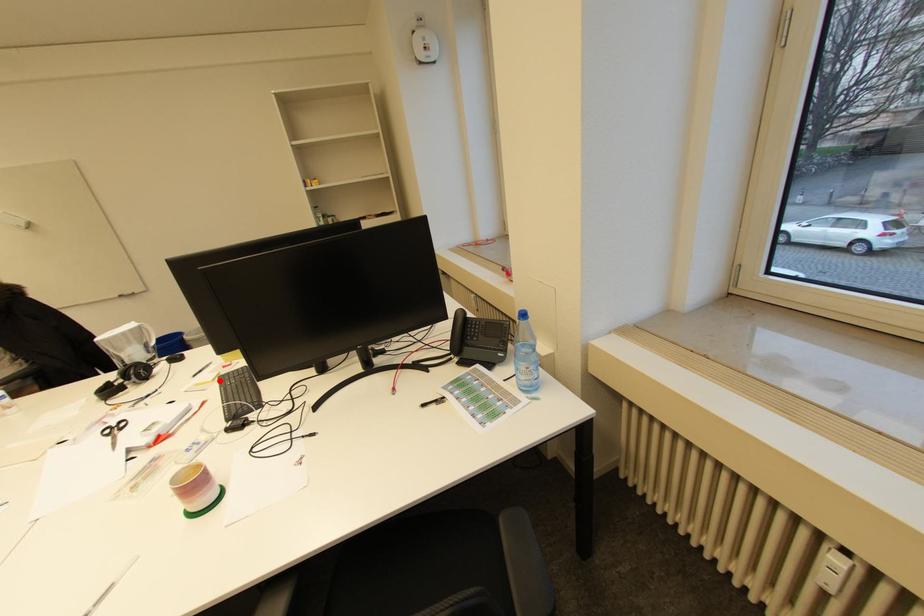
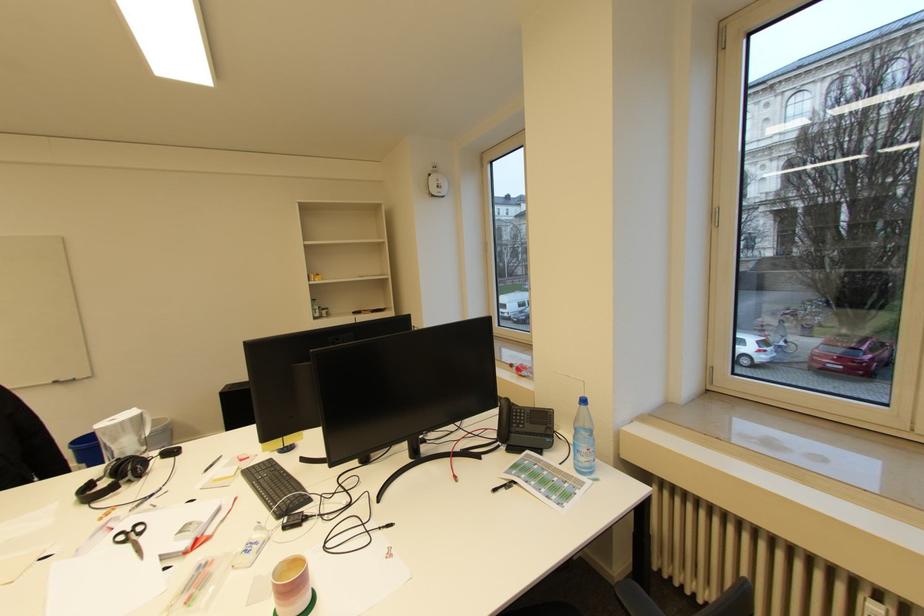
In the second image, find the point that corresponds to the highlighted location in the first image.

(241, 475)